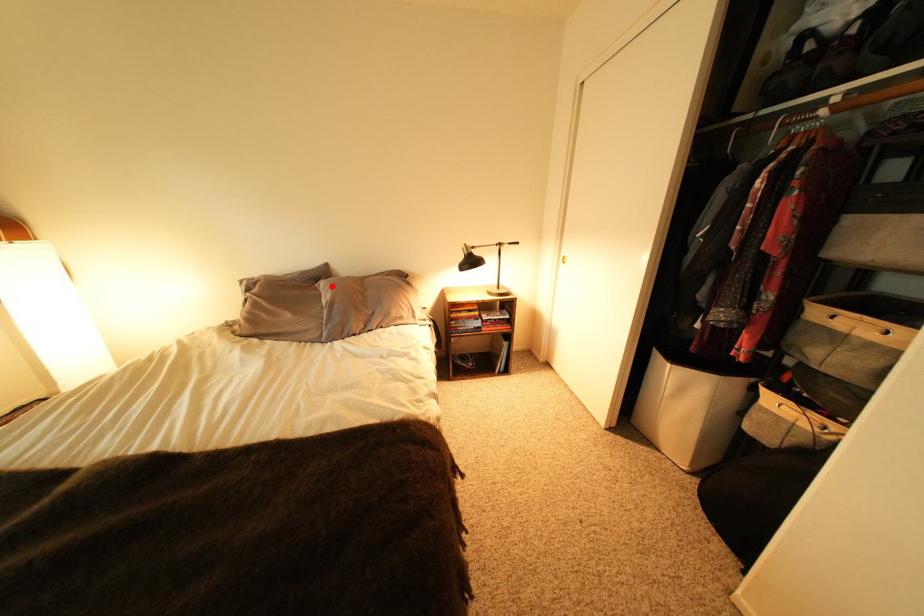
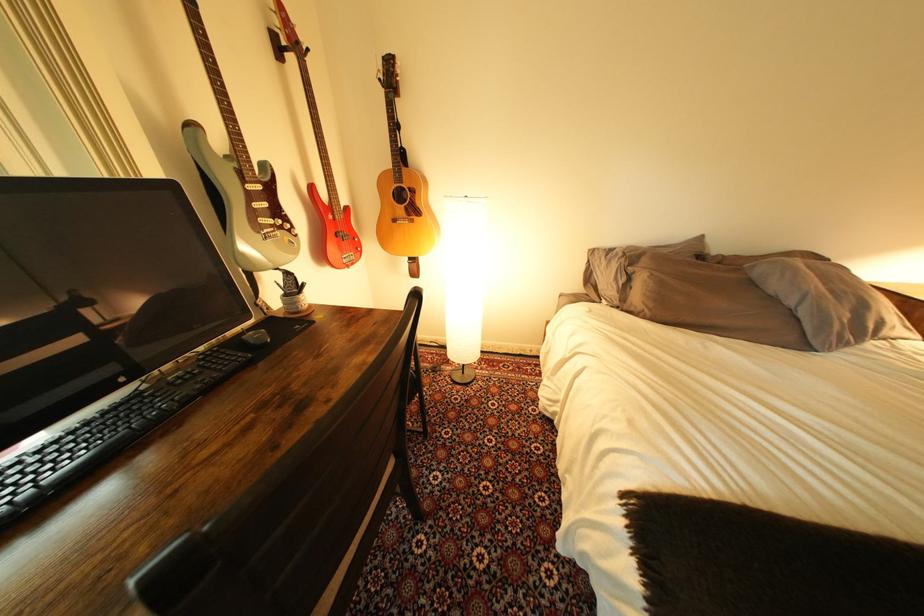
Find the pixel in the second image that matches the highlighted location in the first image.

(767, 268)